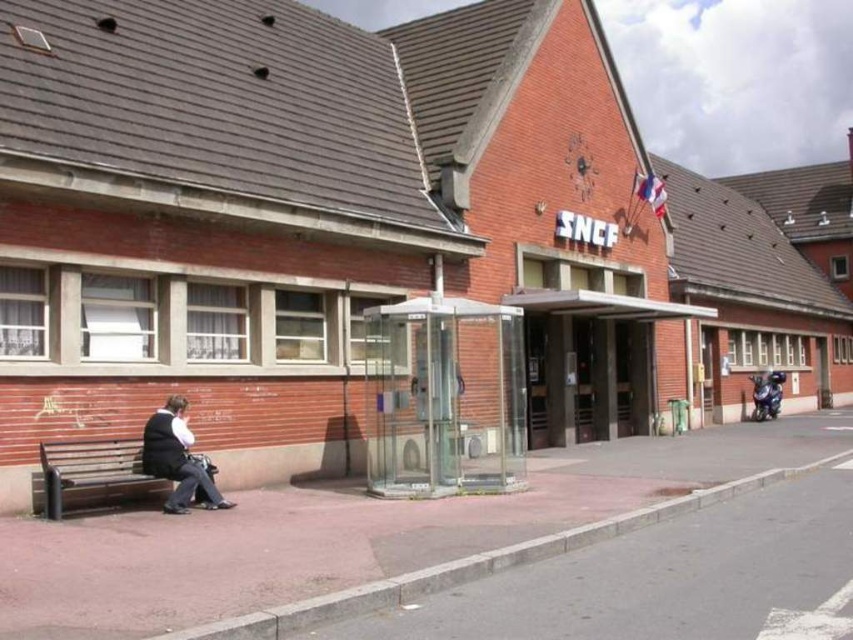
Between point (206, 524) and point (141, 458), which one is positioned behind?

The point (141, 458) is behind.

Who is higher up, brown concrete pavement at lower left or dark gray fabric jacket at lower left?

dark gray fabric jacket at lower left

Is point (213, 568) behind point (207, 484)?

No, (213, 568) is closer to viewer.

The image size is (853, 640). In order to click on brown concrete pavement at lower left in this screenshot , I will do click(x=350, y=531).

Does brown concrete pavement at lower left appear under transparent glass bus stop at center?

Correct, brown concrete pavement at lower left is located below transparent glass bus stop at center.

Who is more forward, [344,515] or [440,442]?

Point [344,515]

The width and height of the screenshot is (853, 640). In order to click on brown concrete pavement at lower left in this screenshot , I will do `click(350, 531)`.

Can you confirm if transparent glass bus stop at center is wider than dark gray fabric jacket at lower left?

Indeed, transparent glass bus stop at center has a greater width compared to dark gray fabric jacket at lower left.

Can you confirm if transparent glass bus stop at center is thinner than dark gray fabric jacket at lower left?

No.

Measure the distance between transparent glass bus stop at center and camera.

10.30 meters

Locate an element on the screen. transparent glass bus stop at center is located at coordinates (444, 397).